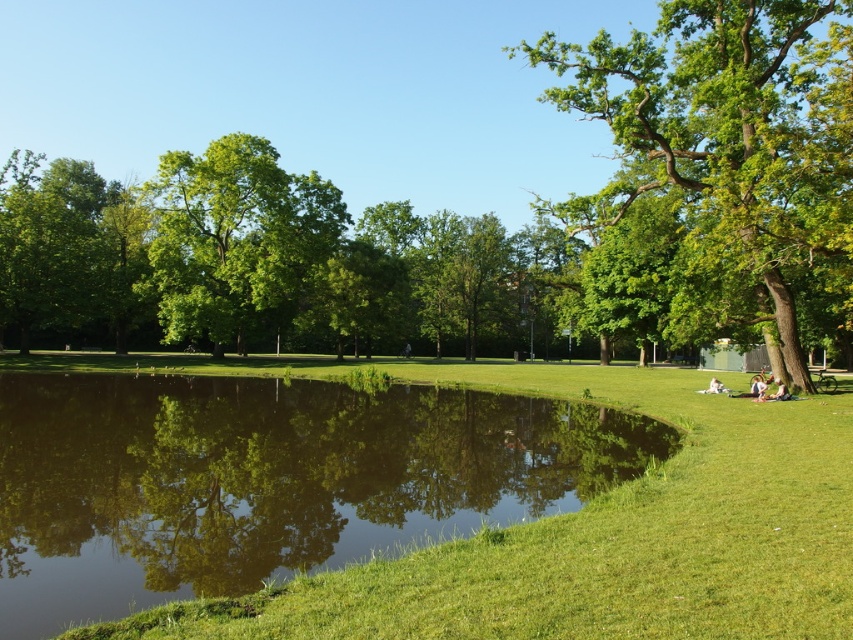
Question: Which object is closer to the camera taking this photo?

Choices:
 (A) green leafy tree at upper left
 (B) green leafy tree at right

Answer: (B)

Question: Which object appears farthest from the camera in this image?

Choices:
 (A) green leafy tree at center
 (B) green reflective water at center

Answer: (A)

Question: Is the position of green reflective water at center more distant than that of green leafy tree at right?

Choices:
 (A) no
 (B) yes

Answer: (A)

Question: Can you confirm if green reflective water at center is positioned below green leafy tree at upper left?

Choices:
 (A) no
 (B) yes

Answer: (B)

Question: Which object is farther from the camera taking this photo?

Choices:
 (A) green reflective water at center
 (B) green leafy tree at right
 (C) green leafy tree at center

Answer: (C)

Question: Where is green reflective water at center located in relation to green leafy tree at right in the image?

Choices:
 (A) right
 (B) left

Answer: (B)